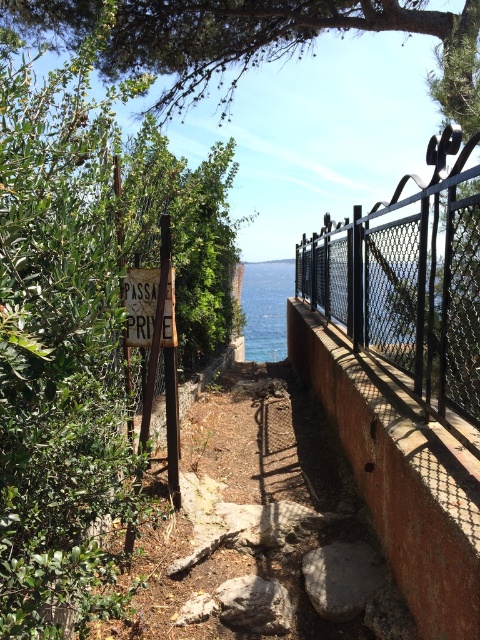
You are a hiker who wants to take a photo of the coastal view ahead. You notice the black metal fence at upper right and the wooden signboard at center in your camera frame. Which object should you adjust your camera angle to avoid blocking the view of the coastal scenery?

The wooden signboard at center is located above the black metal fence at upper right. To avoid blocking the coastal view, adjust your camera angle to position the wooden signboard at center out of the frame while keeping the lower black metal fence at upper right in the shot, as it is less obstructive to the scenery.